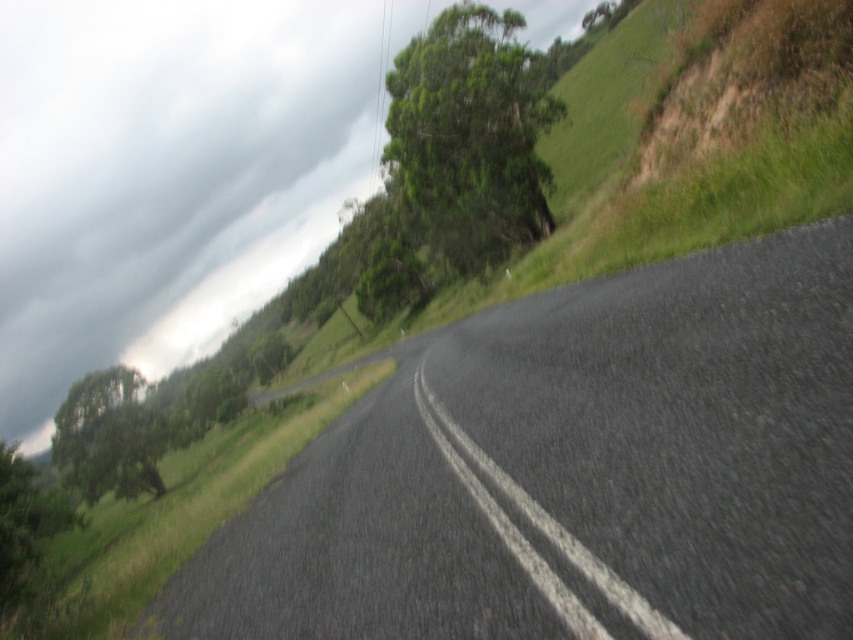
Question: From the image, what is the correct spatial relationship of green leafy tree at upper left in relation to gray asphalt road at center?

Choices:
 (A) left
 (B) right

Answer: (A)

Question: Which of the following is the farthest from the observer?

Choices:
 (A) green leafy tree at upper center
 (B) gray asphalt road at center
 (C) green leafy tree at upper left

Answer: (C)

Question: In this image, where is green leafy tree at upper center located relative to gray asphalt road at center?

Choices:
 (A) above
 (B) below

Answer: (A)

Question: Can you confirm if green leafy tree at upper left is bigger than gray asphalt road at center?

Choices:
 (A) no
 (B) yes

Answer: (B)

Question: Which point appears closest to the camera in this image?

Choices:
 (A) (108, 456)
 (B) (619, 609)

Answer: (B)

Question: Which of the following is the closest to the observer?

Choices:
 (A) green leafy tree at upper left
 (B) gray asphalt road at center

Answer: (B)